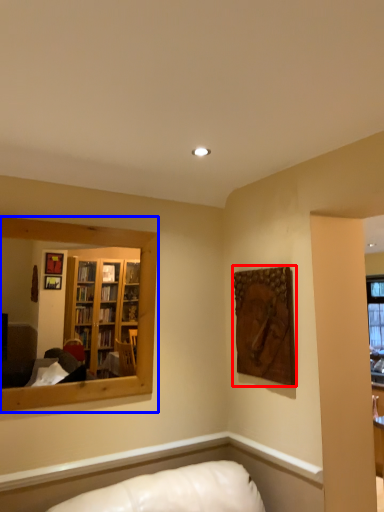
Question: Among these objects, which one is nearest to the camera, picture frame (highlighted by a red box) or mirror (highlighted by a blue box)?

Choices:
 (A) picture frame
 (B) mirror

Answer: (B)